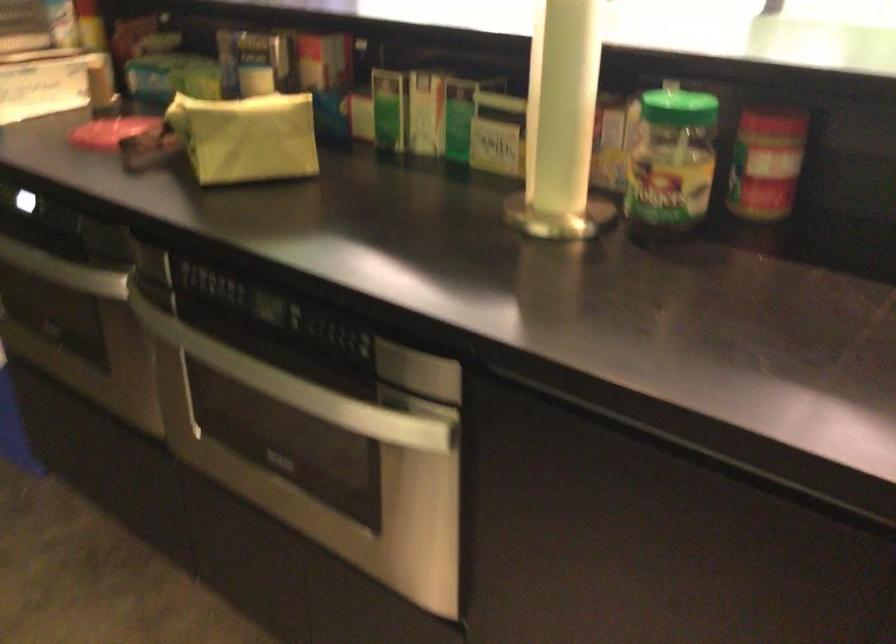
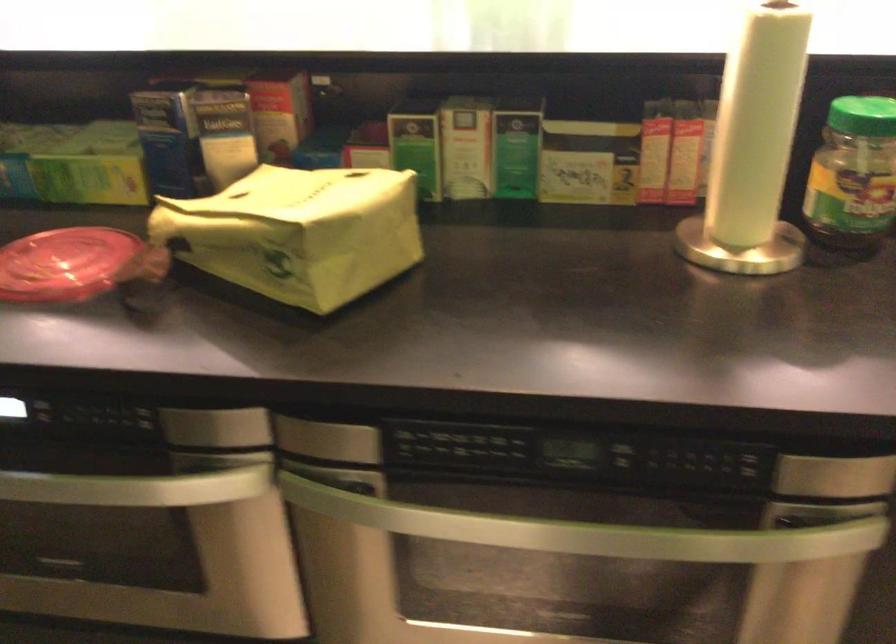
Question: The camera is either moving clockwise (left) or counter-clockwise (right) around the object. The first image is from the beginning of the video and the second image is from the end. Is the camera moving left or right when shooting the video?

Choices:
 (A) Left
 (B) Right

Answer: (A)